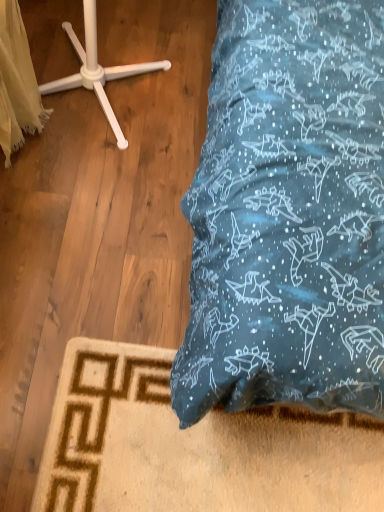
Question: From a real-world perspective, is white fabric at left physically located above or below white plastic coat stand at upper left?

Choices:
 (A) below
 (B) above

Answer: (B)

Question: In terms of height, does white fabric at left look taller or shorter compared to white plastic coat stand at upper left?

Choices:
 (A) tall
 (B) short

Answer: (A)

Question: Considering the positions of white fabric at left and white plastic coat stand at upper left in the image, is white fabric at left bigger or smaller than white plastic coat stand at upper left?

Choices:
 (A) big
 (B) small

Answer: (B)

Question: Is white plastic coat stand at upper left wider or thinner than white fabric at left?

Choices:
 (A) wide
 (B) thin

Answer: (A)

Question: Is white plastic coat stand at upper left in front of or behind white fabric at left in the image?

Choices:
 (A) front
 (B) behind

Answer: (B)

Question: Is white plastic coat stand at upper left to the left or to the right of white fabric at left in the image?

Choices:
 (A) left
 (B) right

Answer: (B)

Question: Is white plastic coat stand at upper left taller or shorter than white fabric at left?

Choices:
 (A) short
 (B) tall

Answer: (A)